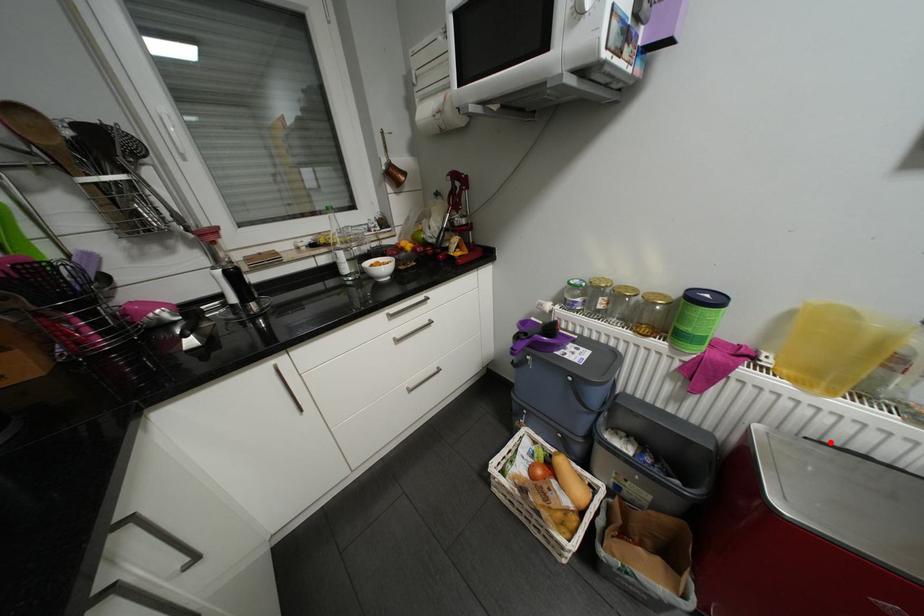
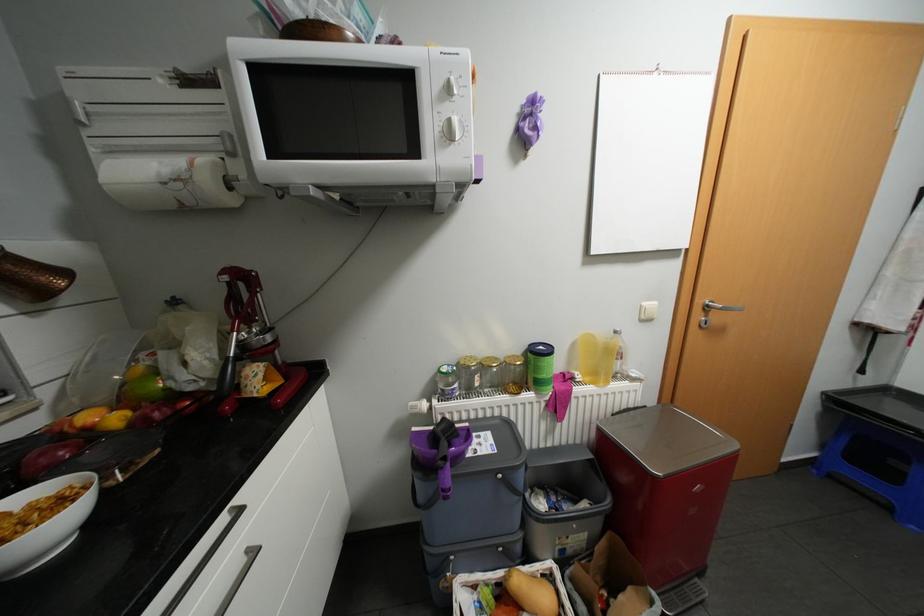
The point at the highlighted location is marked in the first image. Where is the corresponding point in the second image?

(626, 411)